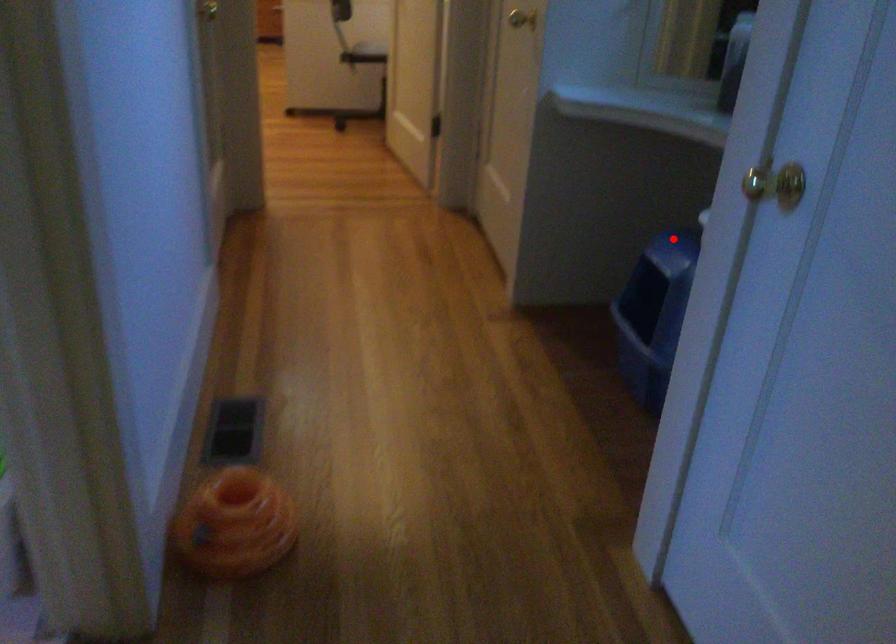
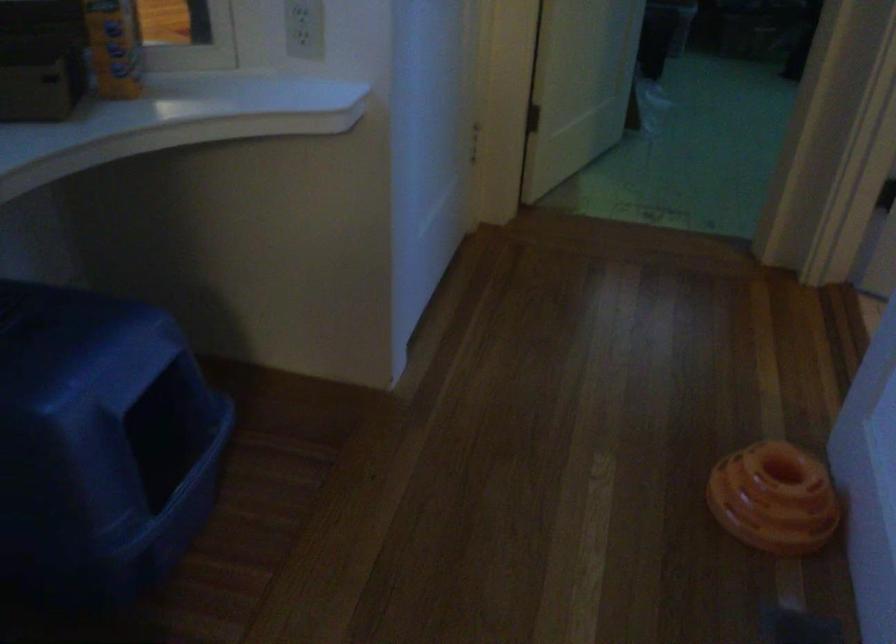
Find the pixel in the second image that matches the highlighted location in the first image.

(99, 442)